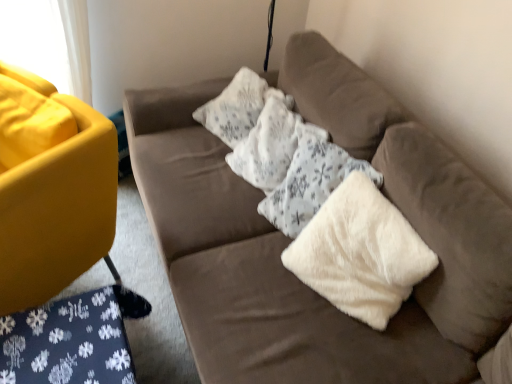
The image size is (512, 384). In order to click on matte yellow couch at left, which is the 1th studio couch from left to right in this screenshot , I will do `click(58, 213)`.

Locate an element on the screen. The image size is (512, 384). white fluffy pillow at center is located at coordinates (271, 143).

Identify the location of matte yellow couch at left, marked as the 2th studio couch in a right-to-left arrangement. This screenshot has height=384, width=512. (58, 213).

Considering the sizes of objects white fluffy pillow at center and white fluffy pillow at center in the image provided, who is wider, white fluffy pillow at center or white fluffy pillow at center?

white fluffy pillow at center is wider.

Is white fluffy pillow at center not within white fluffy pillow at center?

Yes, white fluffy pillow at center is outside of white fluffy pillow at center.

Is point (397, 248) more distant than point (280, 128)?

No.

In order to click on material on the right side of white fluffy pillow at center in this screenshot , I will do `click(360, 253)`.

How many degrees apart are the facing directions of velvet brown couch at center, arranged as the 1th studio couch when viewed from the right, and white fluffy pillow at center?

The angle between the facing direction of velvet brown couch at center, arranged as the 1th studio couch when viewed from the right, and the facing direction of white fluffy pillow at center is 18.5 degrees.

Is velvet brown couch at center, which is the 2th studio couch from left to right, facing away from white fluffy pillow at center?

Absolutely, velvet brown couch at center, which is the 2th studio couch from left to right, is directed away from white fluffy pillow at center.

Which object is further away from the camera taking this photo, velvet brown couch at center, arranged as the 1th studio couch when viewed from the right, or white fluffy pillow at center?

Positioned behind is white fluffy pillow at center.

Does velvet brown couch at center, which is the 2th studio couch from left to right, have a lesser width compared to white fluffy pillow at center?

No, velvet brown couch at center, which is the 2th studio couch from left to right, is not thinner than white fluffy pillow at center.

Is matte yellow couch at left, marked as the 2th studio couch in a right-to-left arrangement, positioned in front of velvet brown couch at center, arranged as the 1th studio couch when viewed from the right?

No, it is not.

Considering the positions of objects matte yellow couch at left, marked as the 2th studio couch in a right-to-left arrangement, and velvet brown couch at center, which is the 2th studio couch from left to right, in the image provided, who is more to the right, matte yellow couch at left, marked as the 2th studio couch in a right-to-left arrangement, or velvet brown couch at center, which is the 2th studio couch from left to right,?

Positioned to the right is velvet brown couch at center, which is the 2th studio couch from left to right.

From the picture: Is matte yellow couch at left, which is the 1th studio couch from left to right, directly adjacent to velvet brown couch at center, which is the 2th studio couch from left to right?

No, matte yellow couch at left, which is the 1th studio couch from left to right, is not touching velvet brown couch at center, which is the 2th studio couch from left to right.

From a real-world perspective, is matte yellow couch at left, which is the 1th studio couch from left to right, positioned under velvet brown couch at center, arranged as the 1th studio couch when viewed from the right, based on gravity?

Yes, from a real-world perspective, matte yellow couch at left, which is the 1th studio couch from left to right, is beneath velvet brown couch at center, arranged as the 1th studio couch when viewed from the right.

Does point (424, 243) come farther from viewer compared to point (93, 261)?

No, it is not.

Is white fluffy pillow at center inside the boundaries of matte yellow couch at left, marked as the 2th studio couch in a right-to-left arrangement, or outside?

white fluffy pillow at center is outside matte yellow couch at left, marked as the 2th studio couch in a right-to-left arrangement.

Consider the image. Considering the relative sizes of white fluffy pillow at center and matte yellow couch at left, which is the 1th studio couch from left to right, in the image provided, is white fluffy pillow at center wider than matte yellow couch at left, which is the 1th studio couch from left to right,?

No.

Considering the sizes of objects white fluffy pillow at center and matte yellow couch at left, marked as the 2th studio couch in a right-to-left arrangement, in the image provided, who is smaller, white fluffy pillow at center or matte yellow couch at left, marked as the 2th studio couch in a right-to-left arrangement,?

Smaller between the two is white fluffy pillow at center.

Is matte yellow couch at left, which is the 1th studio couch from left to right, completely or partially inside velvet brown couch at center, which is the 2th studio couch from left to right?

Definitely not — matte yellow couch at left, which is the 1th studio couch from left to right, is not inside velvet brown couch at center, which is the 2th studio couch from left to right.

Between velvet brown couch at center, which is the 2th studio couch from left to right, and matte yellow couch at left, which is the 1th studio couch from left to right, which one has larger size?

Bigger between the two is velvet brown couch at center, which is the 2th studio couch from left to right.

Does point (38, 297) lie behind point (303, 133)?

No, (38, 297) is in front of (303, 133).

Measure the distance from matte yellow couch at left, which is the 1th studio couch from left to right, to white fluffy pillow at center.

matte yellow couch at left, which is the 1th studio couch from left to right, and white fluffy pillow at center are 24.56 inches apart from each other.

Choose the correct answer: Is matte yellow couch at left, marked as the 2th studio couch in a right-to-left arrangement, inside white fluffy pillow at center or outside it?

matte yellow couch at left, marked as the 2th studio couch in a right-to-left arrangement, cannot be found inside white fluffy pillow at center.

From a real-world perspective, does matte yellow couch at left, which is the 1th studio couch from left to right, sit lower than white fluffy pillow at center?

Yes, from a real-world perspective, matte yellow couch at left, which is the 1th studio couch from left to right, is below white fluffy pillow at center.

Find the location of a particular element. The width and height of the screenshot is (512, 384). studio couch on the left of white fluffy pillow at center is located at coordinates (58, 213).

Which is more to the right, white fluffy pillow at center or matte yellow couch at left, marked as the 2th studio couch in a right-to-left arrangement?

white fluffy pillow at center.

In the scene shown: From a real-world perspective, is white fluffy pillow at center on top of matte yellow couch at left, marked as the 2th studio couch in a right-to-left arrangement?

Yes.

This screenshot has width=512, height=384. Find the location of `material in front of the white fluffy pillow at center`. material in front of the white fluffy pillow at center is located at coordinates (360, 253).

Where is `material above the velvet brown couch at center, which is the 2th studio couch from left to right (from a real-world perspective)`? This screenshot has height=384, width=512. material above the velvet brown couch at center, which is the 2th studio couch from left to right (from a real-world perspective) is located at coordinates (360, 253).

Considering their positions, is velvet brown couch at center, which is the 2th studio couch from left to right, positioned further to matte yellow couch at left, which is the 1th studio couch from left to right, than white fluffy pillow at center?

white fluffy pillow at center is positioned further to the anchor matte yellow couch at left, which is the 1th studio couch from left to right.

When comparing their distances from matte yellow couch at left, which is the 1th studio couch from left to right, does white fluffy pillow at center or velvet brown couch at center, arranged as the 1th studio couch when viewed from the right, seem closer?

The object closer to matte yellow couch at left, which is the 1th studio couch from left to right, is velvet brown couch at center, arranged as the 1th studio couch when viewed from the right.

Estimate the real-world distances between objects in this image. Which object is further from white fluffy pillow at center, white fluffy pillow at center or velvet brown couch at center, which is the 2th studio couch from left to right?

Result: Among the two, white fluffy pillow at center is located further to white fluffy pillow at center.

When comparing their distances from white fluffy pillow at center, does white fluffy pillow at center or matte yellow couch at left, marked as the 2th studio couch in a right-to-left arrangement, seem further?

Based on the image, matte yellow couch at left, marked as the 2th studio couch in a right-to-left arrangement, appears to be further to white fluffy pillow at center.

Estimate the real-world distances between objects in this image. Which object is closer to white fluffy pillow at center, matte yellow couch at left, marked as the 2th studio couch in a right-to-left arrangement, or white fluffy pillow at center?

white fluffy pillow at center.

Considering their positions, is white fluffy pillow at center positioned further to matte yellow couch at left, which is the 1th studio couch from left to right, than white fluffy pillow at center?

white fluffy pillow at center is positioned further to the anchor matte yellow couch at left, which is the 1th studio couch from left to right.

Which object lies nearer to the anchor point white fluffy pillow at center, matte yellow couch at left, marked as the 2th studio couch in a right-to-left arrangement, or velvet brown couch at center, arranged as the 1th studio couch when viewed from the right?

Among the two, velvet brown couch at center, arranged as the 1th studio couch when viewed from the right, is located nearer to white fluffy pillow at center.

Based on their spatial positions, is white fluffy pillow at center or matte yellow couch at left, which is the 1th studio couch from left to right, closer to velvet brown couch at center, which is the 2th studio couch from left to right?

white fluffy pillow at center lies closer to velvet brown couch at center, which is the 2th studio couch from left to right, than the other object.

I want to click on pillow between matte yellow couch at left, which is the 1th studio couch from left to right, and velvet brown couch at center, arranged as the 1th studio couch when viewed from the right, from left to right, so click(271, 143).

Locate an element on the screen. material between velvet brown couch at center, which is the 2th studio couch from left to right, and white fluffy pillow at center from front to back is located at coordinates (360, 253).

The width and height of the screenshot is (512, 384). Identify the location of studio couch between matte yellow couch at left, marked as the 2th studio couch in a right-to-left arrangement, and white fluffy pillow at center from left to right. click(289, 239).

You are a GUI agent. You are given a task and a screenshot of the screen. Output one action in this format:
    pyautogui.click(x=<x>, y=<y>)
    Task: Click on the pillow between matte yellow couch at left, which is the 1th studio couch from left to right, and white fluffy pillow at center from left to right
    This screenshot has height=384, width=512.
    Given the screenshot: What is the action you would take?
    pyautogui.click(x=271, y=143)